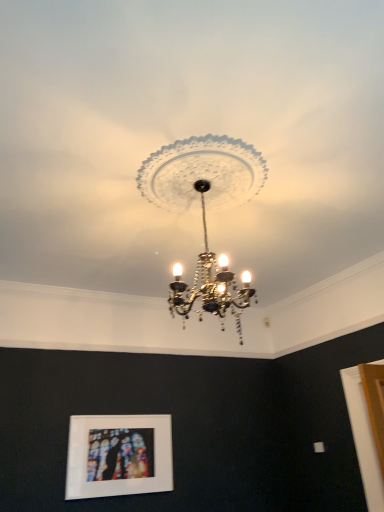
What do you see at coordinates (119, 455) in the screenshot? The width and height of the screenshot is (384, 512). I see `matte white picture frame at lower center` at bounding box center [119, 455].

What is the approximate width of matte white picture frame at lower center?

matte white picture frame at lower center is 2.16 inches in width.

Where is `matte white picture frame at lower center`? matte white picture frame at lower center is located at coordinates (119, 455).

This screenshot has width=384, height=512. I want to click on clear glass chandelier at center, so click(204, 212).

What is the approximate width of clear glass chandelier at center?

31.48 inches.

What do you see at coordinates (204, 212) in the screenshot?
I see `clear glass chandelier at center` at bounding box center [204, 212].

Identify the location of matte white picture frame at lower center. (119, 455).

In the image, is clear glass chandelier at center on the left side or the right side of matte white picture frame at lower center?

clear glass chandelier at center is to the right of matte white picture frame at lower center.

Is clear glass chandelier at center further to camera compared to matte white picture frame at lower center?

No.

Is point (242, 153) positioned in front of point (74, 451)?

Yes, point (242, 153) is in front of point (74, 451).

From the picture: From the image's perspective, who appears lower, clear glass chandelier at center or matte white picture frame at lower center?

matte white picture frame at lower center.

From a real-world perspective, which object stands above the other?

From a 3D spatial view, clear glass chandelier at center is above.

Which object is thinner, clear glass chandelier at center or matte white picture frame at lower center?

matte white picture frame at lower center is thinner.

Considering the sizes of objects clear glass chandelier at center and matte white picture frame at lower center in the image provided, who is taller, clear glass chandelier at center or matte white picture frame at lower center?

clear glass chandelier at center is taller.

Considering the relative sizes of clear glass chandelier at center and matte white picture frame at lower center in the image provided, is clear glass chandelier at center bigger than matte white picture frame at lower center?

Yes.

Is clear glass chandelier at center inside or outside of matte white picture frame at lower center?

The correct answer is: outside.

Is clear glass chandelier at center not close to matte white picture frame at lower center?

clear glass chandelier at center is far away from matte white picture frame at lower center.

Could you tell me if clear glass chandelier at center is facing matte white picture frame at lower center?

No, clear glass chandelier at center is not aimed at matte white picture frame at lower center.

What's the angular difference between clear glass chandelier at center and matte white picture frame at lower center's facing directions?

The facing directions of clear glass chandelier at center and matte white picture frame at lower center are 90.7 degrees apart.

You are a GUI agent. You are given a task and a screenshot of the screen. Output one action in this format:
    pyautogui.click(x=<x>, y=<y>)
    Task: Click on the lamp above the matte white picture frame at lower center (from a real-world perspective)
    
    Given the screenshot: What is the action you would take?
    pyautogui.click(x=204, y=212)

Based on the photo, considering the positions of objects matte white picture frame at lower center and clear glass chandelier at center in the image provided, who is more to the left, matte white picture frame at lower center or clear glass chandelier at center?

matte white picture frame at lower center.

Which object is more forward, matte white picture frame at lower center or clear glass chandelier at center?

clear glass chandelier at center is more forward.

Is point (147, 432) closer to viewer compared to point (147, 161)?

No, it is behind (147, 161).

From the picture: From the image's perspective, would you say matte white picture frame at lower center is shown under clear glass chandelier at center?

Yes.

From a real-world perspective, is matte white picture frame at lower center physically located above or below clear glass chandelier at center?

matte white picture frame at lower center is below clear glass chandelier at center.

Between matte white picture frame at lower center and clear glass chandelier at center, which one has larger width?

With larger width is clear glass chandelier at center.

Between matte white picture frame at lower center and clear glass chandelier at center, which one has less height?

matte white picture frame at lower center is shorter.

Considering the sizes of matte white picture frame at lower center and clear glass chandelier at center in the image, is matte white picture frame at lower center bigger or smaller than clear glass chandelier at center?

Clearly, matte white picture frame at lower center is smaller in size than clear glass chandelier at center.

Would you say matte white picture frame at lower center contains clear glass chandelier at center?

No, matte white picture frame at lower center does not contain clear glass chandelier at center.

Would you consider matte white picture frame at lower center to be distant from clear glass chandelier at center?

That's right, there is a large distance between matte white picture frame at lower center and clear glass chandelier at center.

Is matte white picture frame at lower center turned away from clear glass chandelier at center?

No.

Can you tell me how much matte white picture frame at lower center and clear glass chandelier at center differ in facing direction?

They differ by 90.7 degrees in their facing directions.

Where is `lamp located above the matte white picture frame at lower center (from a real-world perspective)`? The image size is (384, 512). lamp located above the matte white picture frame at lower center (from a real-world perspective) is located at coordinates (204, 212).

Identify the location of lamp above the matte white picture frame at lower center (from the image's perspective). The width and height of the screenshot is (384, 512). (204, 212).

At what (x,y) coordinates should I click in order to perform the action: click on lamp on the right of matte white picture frame at lower center. Please return your answer as a coordinate pair (x, y). This screenshot has width=384, height=512. Looking at the image, I should click on (x=204, y=212).